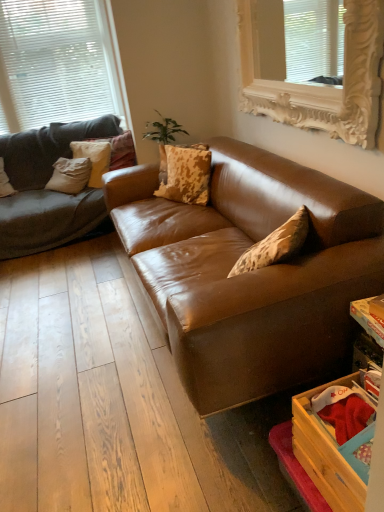
Question: Can we say textured beige pillow at left, which is the 3th pillow from right to left, lies outside matte gray pillow at left, the fourth pillow when ordered from right to left?

Choices:
 (A) no
 (B) yes

Answer: (B)

Question: From the image's perspective, is textured beige pillow at left, marked as the second pillow in a left-to-right arrangement, below matte gray pillow at left, which ranks as the first pillow in left-to-right order?

Choices:
 (A) no
 (B) yes

Answer: (A)

Question: Is textured beige pillow at left, marked as the second pillow in a left-to-right arrangement, to the left of matte gray pillow at left, the fourth pillow when ordered from right to left, from the viewer's perspective?

Choices:
 (A) yes
 (B) no

Answer: (B)

Question: Could you tell me if textured beige pillow at left, marked as the second pillow in a left-to-right arrangement, is turned towards matte gray pillow at left, which ranks as the first pillow in left-to-right order?

Choices:
 (A) yes
 (B) no

Answer: (B)

Question: From a real-world perspective, is textured beige pillow at left, which is the 3th pillow from right to left, positioned over matte gray pillow at left, which ranks as the first pillow in left-to-right order, based on gravity?

Choices:
 (A) yes
 (B) no

Answer: (B)

Question: From a real-world perspective, is leopard print fabric pillow at center, marked as the 4th pillow in a left-to-right arrangement, positioned above or below brown leather couch at center?

Choices:
 (A) above
 (B) below

Answer: (A)

Question: Is leopard print fabric pillow at center, which is counted as the 1th pillow, starting from the right, taller or shorter than brown leather couch at center?

Choices:
 (A) tall
 (B) short

Answer: (B)

Question: Looking at the image, does leopard print fabric pillow at center, which is counted as the 1th pillow, starting from the right, seem bigger or smaller compared to brown leather couch at center?

Choices:
 (A) small
 (B) big

Answer: (A)

Question: Would you say leopard print fabric pillow at center, marked as the 4th pillow in a left-to-right arrangement, is to the left or to the right of brown leather couch at center in the picture?

Choices:
 (A) right
 (B) left

Answer: (B)

Question: Is brown leather couch at center wider or thinner than white matte window at upper left, which is the first window from back to front?

Choices:
 (A) thin
 (B) wide

Answer: (B)

Question: Based on their positions, is brown leather couch at center located to the left or right of white matte window at upper left, which appears as the first window when viewed from the left?

Choices:
 (A) left
 (B) right

Answer: (B)

Question: Considering the positions of brown leather couch at center and white matte window at upper left, which is the first window from back to front, in the image, is brown leather couch at center taller or shorter than white matte window at upper left, which is the first window from back to front,?

Choices:
 (A) tall
 (B) short

Answer: (B)

Question: Is point (135, 209) positioned closer to the camera than point (19, 65)?

Choices:
 (A) closer
 (B) farther

Answer: (A)

Question: From a real-world perspective, relative to white textured pillow at upper left, positioned as the second pillow in right-to-left order, is white ornate frame at upper center, which ranks as the 2th window in left-to-right order, vertically above or below?

Choices:
 (A) above
 (B) below

Answer: (A)

Question: Considering the positions of white ornate frame at upper center, marked as the 2th window in a back-to-front arrangement, and white textured pillow at upper left, the 3th pillow when ordered from left to right, in the image, is white ornate frame at upper center, marked as the 2th window in a back-to-front arrangement, taller or shorter than white textured pillow at upper left, the 3th pillow when ordered from left to right,?

Choices:
 (A) short
 (B) tall

Answer: (B)